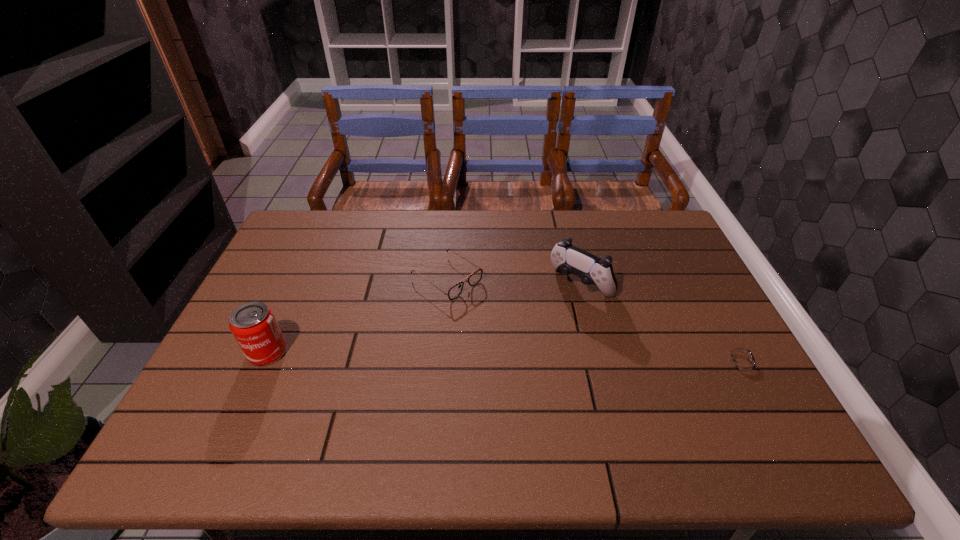
Identify the location of free region located 0.170m on the front-facing side of the sunglasses. The image size is (960, 540). (516, 326).

Locate an element on the screen. vacant space situated on the front-facing side of the sunglasses is located at coordinates (514, 325).

This screenshot has width=960, height=540. I want to click on free space located 0.080m on the front-facing side of the sunglasses, so click(492, 309).

The image size is (960, 540). In order to click on object positioned at the left edge in this screenshot , I will do `click(254, 326)`.

Locate an element on the screen. The image size is (960, 540). object present at the right edge is located at coordinates (738, 359).

Locate an element on the screen. Image resolution: width=960 pixels, height=540 pixels. vacant area at the far edge is located at coordinates (522, 218).

Locate an element on the screen. The width and height of the screenshot is (960, 540). free space at the near edge of the desktop is located at coordinates (670, 395).

At what (x,y) coordinates should I click in order to perform the action: click on vacant space at the right edge of the desktop. Please return your answer as a coordinate pair (x, y). This screenshot has width=960, height=540. Looking at the image, I should click on (704, 302).

You are a GUI agent. You are given a task and a screenshot of the screen. Output one action in this format:
    pyautogui.click(x=<x>, y=<y>)
    Task: Click on the free space at the near left corner of the desktop
    This screenshot has width=960, height=540.
    Given the screenshot: What is the action you would take?
    pyautogui.click(x=198, y=390)

What are the coordinates of `free spot at the far right corner of the desktop` in the screenshot? It's located at (648, 210).